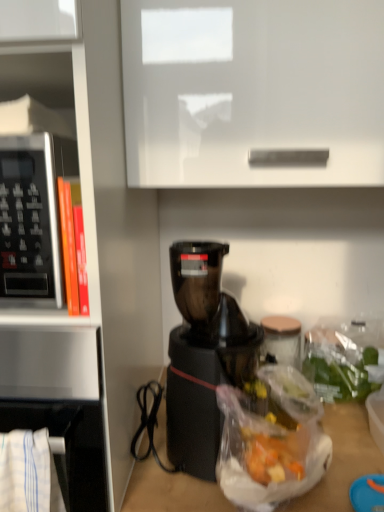
Question: Considering the relative positions of black plastic coffee maker at center and satin silver microwave at left in the image provided, is black plastic coffee maker at center in front of satin silver microwave at left?

Choices:
 (A) yes
 (B) no

Answer: (B)

Question: From the image's perspective, does black plastic coffee maker at center appear lower than satin silver microwave at left?

Choices:
 (A) yes
 (B) no

Answer: (A)

Question: Is black plastic coffee maker at center turned away from satin silver microwave at left?

Choices:
 (A) yes
 (B) no

Answer: (B)

Question: Are black plastic coffee maker at center and satin silver microwave at left located far from each other?

Choices:
 (A) no
 (B) yes

Answer: (A)

Question: Does black plastic coffee maker at center have a larger size compared to satin silver microwave at left?

Choices:
 (A) no
 (B) yes

Answer: (A)

Question: Considering the positions of point (342, 392) and point (44, 224), is point (342, 392) closer or farther from the camera than point (44, 224)?

Choices:
 (A) closer
 (B) farther

Answer: (B)

Question: Would you say translucent plastic bag at lower right is inside or outside black plastic microwave at left?

Choices:
 (A) inside
 (B) outside

Answer: (B)

Question: In the image, is translucent plastic bag at lower right on the left side or the right side of black plastic microwave at left?

Choices:
 (A) right
 (B) left

Answer: (A)

Question: Is translucent plastic bag at lower right wider or thinner than black plastic microwave at left?

Choices:
 (A) wide
 (B) thin

Answer: (B)

Question: Considering their positions, is satin silver microwave at left located in front of or behind black plastic microwave at left?

Choices:
 (A) front
 (B) behind

Answer: (A)

Question: From a real-world perspective, is satin silver microwave at left above or below black plastic microwave at left?

Choices:
 (A) below
 (B) above

Answer: (B)

Question: From the image's perspective, is satin silver microwave at left positioned above or below black plastic microwave at left?

Choices:
 (A) below
 (B) above

Answer: (B)

Question: Is point (102, 354) positioned closer to the camera than point (41, 223)?

Choices:
 (A) closer
 (B) farther

Answer: (B)

Question: Considering their positions, is satin silver microwave at left located in front of or behind black plastic coffee maker at center?

Choices:
 (A) behind
 (B) front

Answer: (B)

Question: Is satin silver microwave at left bigger or smaller than black plastic coffee maker at center?

Choices:
 (A) big
 (B) small

Answer: (A)